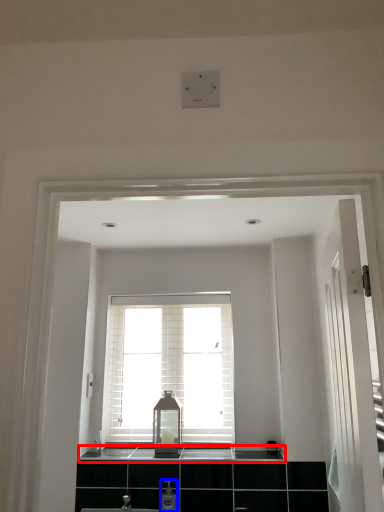
Question: Among these objects, which one is farthest to the camera, counter top (highlighted by a red box) or toiletry (highlighted by a blue box)?

Choices:
 (A) counter top
 (B) toiletry

Answer: (A)